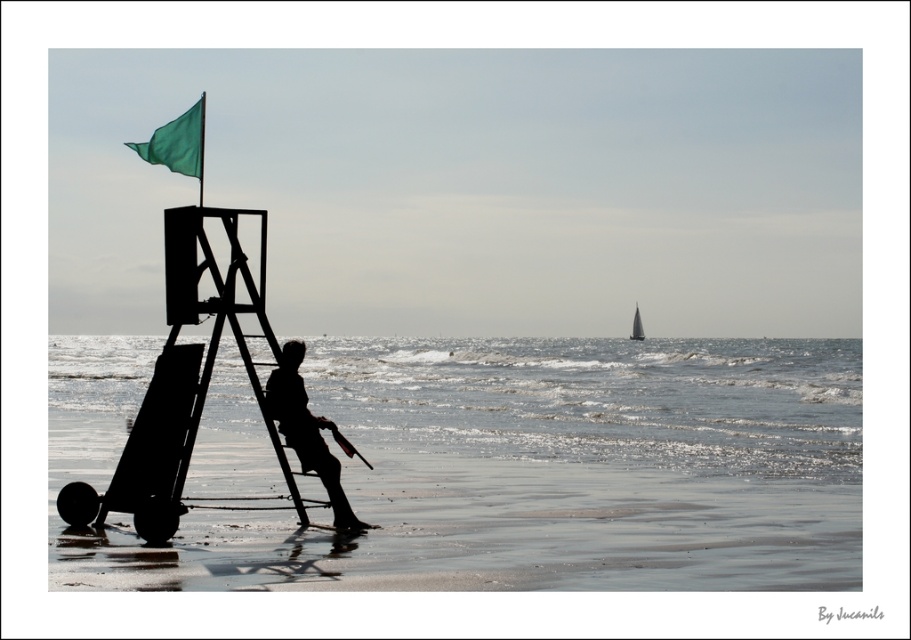
Question: Does clear water at center appear under silhouette wood person at center?

Choices:
 (A) no
 (B) yes

Answer: (A)

Question: Which point appears closest to the camera in this image?

Choices:
 (A) (403, 420)
 (B) (183, 115)
 (C) (359, 484)
 (D) (294, 342)

Answer: (D)

Question: Can you confirm if clear water at center is positioned below green fabric flag at upper left?

Choices:
 (A) yes
 (B) no

Answer: (A)

Question: Estimate the real-world distances between objects in this image. Which object is farther from the clear water at center?

Choices:
 (A) green fabric flag at upper left
 (B) silhouette wood person at center

Answer: (B)

Question: Observing the image, what is the correct spatial positioning of smooth sand at lower center in reference to clear water at center?

Choices:
 (A) below
 (B) above

Answer: (A)

Question: Among these points, which one is nearest to the camera?

Choices:
 (A) (130, 145)
 (B) (647, 458)

Answer: (B)